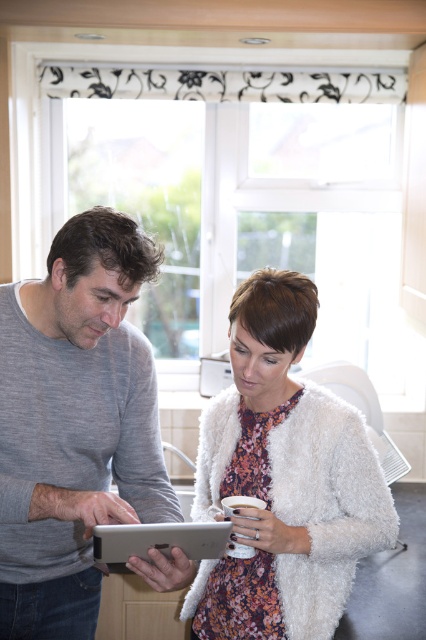
Question: Which point is farther from the camera taking this photo?

Choices:
 (A) (42, 428)
 (B) (322, 404)
 (C) (32, 296)
 (D) (100, 563)

Answer: (B)

Question: Among these objects, which one is nearest to the camera?

Choices:
 (A) white fluffy cardigan at center
 (B) white fluffy jacket at center

Answer: (B)

Question: Is white fluffy cardigan at center wider than silver metallic tablet at center?

Choices:
 (A) yes
 (B) no

Answer: (A)

Question: Which of these objects is positioned farthest from the white fluffy jacket at center?

Choices:
 (A) white fluffy cardigan at center
 (B) silver metallic tablet at center

Answer: (B)

Question: Is white fluffy jacket at center positioned in front of white fluffy cardigan at center?

Choices:
 (A) yes
 (B) no

Answer: (A)

Question: Does gray matte shirt at left appear on the left side of white fluffy cardigan at center?

Choices:
 (A) yes
 (B) no

Answer: (A)